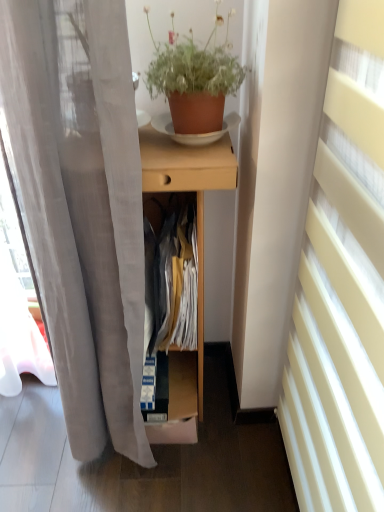
Question: Is light wood desk at center at the back of white sheer curtain at right?

Choices:
 (A) yes
 (B) no

Answer: (B)

Question: Can you confirm if white sheer curtain at right is wider than light wood desk at center?

Choices:
 (A) yes
 (B) no

Answer: (B)

Question: From the image's perspective, is white sheer curtain at right on light wood desk at center?

Choices:
 (A) no
 (B) yes

Answer: (A)

Question: Is white sheer curtain at right not near light wood desk at center?

Choices:
 (A) yes
 (B) no

Answer: (B)

Question: From a real-world perspective, is white sheer curtain at right located beneath light wood desk at center?

Choices:
 (A) no
 (B) yes

Answer: (A)

Question: Considering the relative sizes of white sheer curtain at right and light wood desk at center in the image provided, is white sheer curtain at right bigger than light wood desk at center?

Choices:
 (A) yes
 (B) no

Answer: (B)

Question: Is the depth of light wood desk at center less than that of terracotta clay pot at upper center?

Choices:
 (A) no
 (B) yes

Answer: (A)

Question: From the image's perspective, is light wood desk at center below terracotta clay pot at upper center?

Choices:
 (A) yes
 (B) no

Answer: (A)

Question: From the image's perspective, is light wood desk at center located above terracotta clay pot at upper center?

Choices:
 (A) yes
 (B) no

Answer: (B)

Question: Is light wood desk at center taller than terracotta clay pot at upper center?

Choices:
 (A) yes
 (B) no

Answer: (A)

Question: Is light wood desk at center not near terracotta clay pot at upper center?

Choices:
 (A) no
 (B) yes

Answer: (A)

Question: Considering the relative sizes of light wood desk at center and terracotta clay pot at upper center in the image provided, is light wood desk at center bigger than terracotta clay pot at upper center?

Choices:
 (A) no
 (B) yes

Answer: (B)

Question: Is terracotta clay pot at upper center to the right of white sheer curtain at right from the viewer's perspective?

Choices:
 (A) no
 (B) yes

Answer: (A)